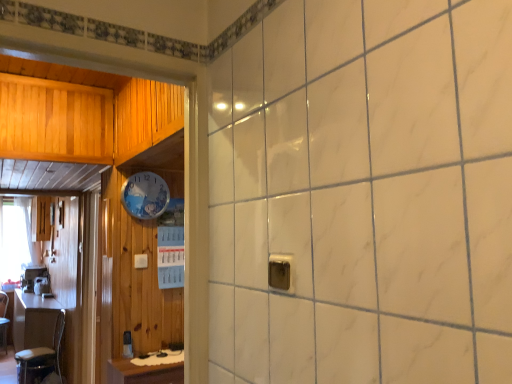
Describe the element at coordinates (15, 239) in the screenshot. This screenshot has height=384, width=512. I see `white sheer curtain at left` at that location.

Locate an element on the screen. metallic silver chair at left is located at coordinates (42, 357).

The image size is (512, 384). Describe the element at coordinates (42, 357) in the screenshot. I see `metallic silver chair at left` at that location.

From the picture: In order to face white glossy clock at upper center, should I rotate leftwards or rightwards?

To align with it, rotate left about 14.251°.

The width and height of the screenshot is (512, 384). Identify the location of white glossy clock at upper center. (145, 195).

In order to face wooden cabinet at left, should I rotate leftwards or rightwards?

You should look left and rotate roughly 26.346 degrees.

The image size is (512, 384). I want to click on white sheer curtain at left, so click(x=15, y=239).

Considering the sizes of wooden table at left and white glossy clock at upper center in the image, is wooden table at left wider or thinner than white glossy clock at upper center?

Clearly, wooden table at left has more width compared to white glossy clock at upper center.

Can you confirm if wooden table at left is positioned to the left of white glossy clock at upper center?

In fact, wooden table at left is to the right of white glossy clock at upper center.

In the image, is wooden table at left positioned in front of or behind white glossy clock at upper center?

Visually, wooden table at left is located in front of white glossy clock at upper center.

Does wooden table at left touch white glossy clock at upper center?

No, wooden table at left is not next to white glossy clock at upper center.

The width and height of the screenshot is (512, 384). What are the coordinates of `window on the left of the white glossy clock at upper center` in the screenshot? It's located at (15, 239).

Is white sheer curtain at left touching white glossy clock at upper center?

white sheer curtain at left and white glossy clock at upper center are not in contact.

Can you confirm if white sheer curtain at left is positioned to the right of white glossy clock at upper center?

No, white sheer curtain at left is not to the right of white glossy clock at upper center.

Can you tell me how much metallic silver outlet at center and wooden cabinet at left differ in facing direction?

There is a 0.387-degree angle between the facing directions of metallic silver outlet at center and wooden cabinet at left.

Is wooden cabinet at left inside metallic silver outlet at center?

No, wooden cabinet at left is not inside metallic silver outlet at center.

Is metallic silver outlet at center oriented away from wooden cabinet at left?

metallic silver outlet at center is not turned away from wooden cabinet at left.

Between metallic silver outlet at center and wooden cabinet at left, which one appears on the left side from the viewer's perspective?

Positioned to the left is wooden cabinet at left.

Consider the image. From a real-world perspective, is wooden cabinet at left located higher than white sheer curtain at left?

Yes, from a real-world perspective, wooden cabinet at left is above white sheer curtain at left.

From the image's perspective, is wooden cabinet at left under white sheer curtain at left?

No.

Locate an element on the screen. cabinetry in front of the white sheer curtain at left is located at coordinates (40, 218).

The width and height of the screenshot is (512, 384). Identify the location of table above the metallic silver chair at left (from the image's perspective). (147, 370).

Is point (57, 375) closer or farther from the camera than point (125, 361)?

Point (57, 375) is farther from the camera than point (125, 361).

Is metallic silver chair at left to the right of wooden table at left from the viewer's perspective?

In fact, metallic silver chair at left is to the left of wooden table at left.

Is wooden table at left directly adjacent to white sheer curtain at left?

There is a gap between wooden table at left and white sheer curtain at left.

Considering the positions of objects wooden table at left and white sheer curtain at left in the image provided, who is more to the right, wooden table at left or white sheer curtain at left?

Positioned to the right is wooden table at left.

Does point (139, 379) lie in front of point (0, 249)?

Yes.

Locate an element on the screen. window on the left of wooden table at left is located at coordinates (15, 239).

Looking at this image, how many degrees apart are the facing directions of white glossy clock at upper center and white sheer curtain at left?

They differ by 0.753 degrees in their facing directions.

Could you tell me if white glossy clock at upper center is facing white sheer curtain at left?

No, white glossy clock at upper center is not aimed at white sheer curtain at left.

From the image's perspective, relative to white sheer curtain at left, is white glossy clock at upper center above or below?

white glossy clock at upper center is situated higher than white sheer curtain at left in the image.

Is white glossy clock at upper center thinner than white sheer curtain at left?

Correct, the width of white glossy clock at upper center is less than that of white sheer curtain at left.

You are a GUI agent. You are given a task and a screenshot of the screen. Output one action in this format:
    pyautogui.click(x=<x>, y=<y>)
    Task: Click on the clock on the left of wooden table at left
    
    Given the screenshot: What is the action you would take?
    pyautogui.click(x=145, y=195)

This screenshot has width=512, height=384. What are the coordinates of `clock that is on the right side of white sheer curtain at left` in the screenshot? It's located at (145, 195).

Estimate the real-world distances between objects in this image. Which object is further from white glossy clock at upper center, wooden table at left or wooden cabinet at left?

Based on the image, wooden cabinet at left appears to be further to white glossy clock at upper center.

Which object lies further to the anchor point metallic silver outlet at center, wooden cabinet at left or white glossy clock at upper center?

Among the two, wooden cabinet at left is located further to metallic silver outlet at center.

Which object lies nearer to the anchor point white glossy clock at upper center, wooden cabinet at left or white sheer curtain at left?

Based on the image, wooden cabinet at left appears to be nearer to white glossy clock at upper center.

Looking at the image, which one is located further to white glossy clock at upper center, wooden table at left or metallic silver outlet at center?

metallic silver outlet at center is further to white glossy clock at upper center.

Looking at the image, which one is located closer to metallic silver outlet at center, white glossy clock at upper center or wooden cabinet at left?

Among the two, white glossy clock at upper center is located nearer to metallic silver outlet at center.

Based on their spatial positions, is wooden table at left or white sheer curtain at left closer to metallic silver chair at left?

white sheer curtain at left lies closer to metallic silver chair at left than the other object.

Considering their positions, is wooden table at left positioned closer to wooden cabinet at left than white glossy clock at upper center?

white glossy clock at upper center is closer to wooden cabinet at left.

Based on their spatial positions, is metallic silver chair at left or wooden cabinet at left closer to metallic silver outlet at center?

Based on the image, wooden cabinet at left appears to be nearer to metallic silver outlet at center.

This screenshot has width=512, height=384. I want to click on chair between metallic silver outlet at center and wooden cabinet at left in the front-back direction, so click(x=42, y=357).

Identify the location of clock between wooden table at left and metallic silver chair at left from front to back. The height and width of the screenshot is (384, 512). (145, 195).

The image size is (512, 384). I want to click on clock between wooden table at left and white sheer curtain at left from front to back, so click(x=145, y=195).

Locate an element on the screen. The height and width of the screenshot is (384, 512). clock between metallic silver outlet at center and metallic silver chair at left from front to back is located at coordinates (145, 195).